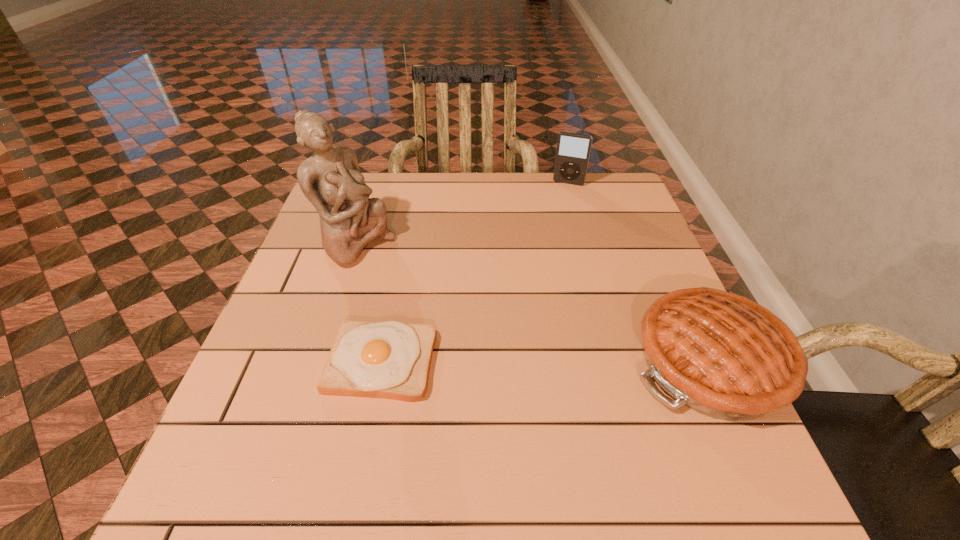
This screenshot has width=960, height=540. In order to click on vacant region located 0.190m on the front-facing side of the figurine in this screenshot , I will do `click(434, 298)`.

The width and height of the screenshot is (960, 540). Identify the location of blank area located 0.300m on the front-facing side of the farthest object. (544, 246).

This screenshot has height=540, width=960. I want to click on vacant space located 0.230m on the front-facing side of the farthest object, so click(549, 230).

You are a GUI agent. You are given a task and a screenshot of the screen. Output one action in this format:
    pyautogui.click(x=<x>, y=<y>)
    Task: Click on the free location located 0.280m on the front-facing side of the farthest object
    Image resolution: width=960 pixels, height=540 pixels.
    Given the screenshot: What is the action you would take?
    pyautogui.click(x=545, y=241)

The width and height of the screenshot is (960, 540). What are the coordinates of `object that is positioned at the far edge` in the screenshot? It's located at (573, 150).

In order to click on toast at the near edge in this screenshot , I will do `click(391, 359)`.

Find the location of `pie at the near edge`. pie at the near edge is located at coordinates click(721, 354).

Where is `toast that is at the left edge`? The width and height of the screenshot is (960, 540). toast that is at the left edge is located at coordinates (391, 359).

Where is `figurine at the left edge`? The height and width of the screenshot is (540, 960). figurine at the left edge is located at coordinates (331, 180).

You are a GUI agent. You are given a task and a screenshot of the screen. Output one action in this format:
    pyautogui.click(x=<x>, y=<y>)
    Task: Click on the pie located in the right edge section of the desktop
    This screenshot has height=540, width=960.
    Given the screenshot: What is the action you would take?
    pyautogui.click(x=721, y=354)